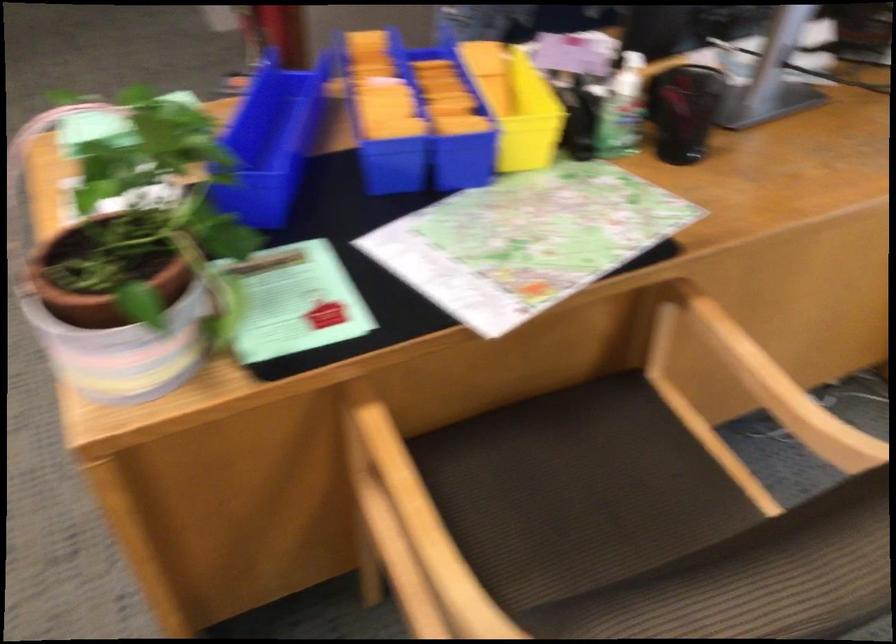
The height and width of the screenshot is (644, 896). Describe the element at coordinates (607, 509) in the screenshot. I see `the chair sitting surface` at that location.